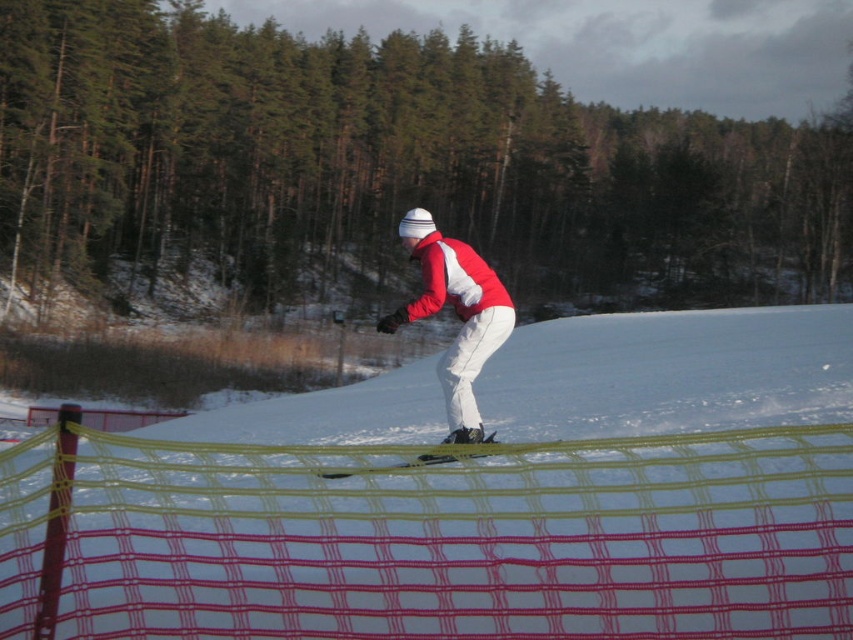
Question: Can you confirm if yellow mesh fence at center is positioned above matte red snowboarder at center?

Choices:
 (A) yes
 (B) no

Answer: (B)

Question: Considering the real-world distances, which object is closest to the yellow mesh fence at center?

Choices:
 (A) green leafy tree at upper center
 (B) matte red snowboarder at center

Answer: (B)

Question: Based on their relative distances, which object is farther from the matte red snowboarder at center?

Choices:
 (A) green leafy tree at upper center
 (B) yellow mesh fence at center

Answer: (A)

Question: Is yellow mesh fence at center behind matte red snowboarder at center?

Choices:
 (A) no
 (B) yes

Answer: (A)

Question: Can you confirm if green leafy tree at upper center is bigger than matte red snowboarder at center?

Choices:
 (A) yes
 (B) no

Answer: (A)

Question: Among these objects, which one is nearest to the camera?

Choices:
 (A) green leafy tree at upper center
 (B) yellow mesh fence at center
 (C) matte red snowboarder at center

Answer: (B)